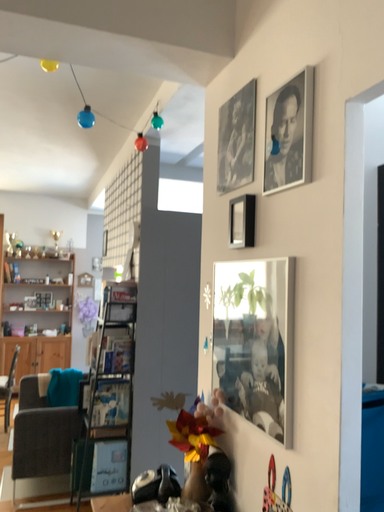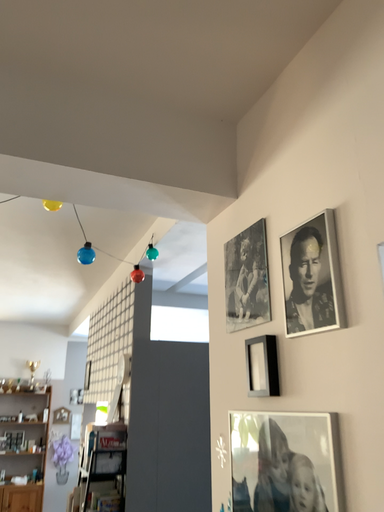
Question: Which way did the camera rotate in the video?

Choices:
 (A) rotated upward
 (B) rotated downward

Answer: (A)